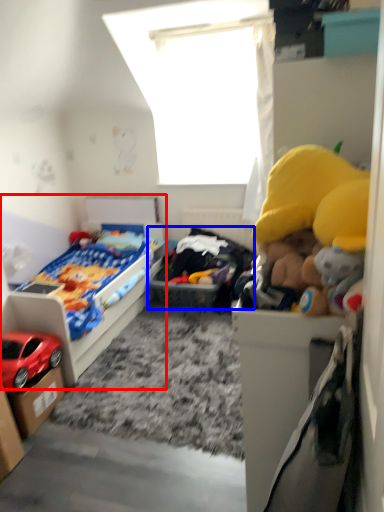
Question: Which of the following is the farthest to the observer, bed (highlighted by a red box) or toy (highlighted by a blue box)?

Choices:
 (A) bed
 (B) toy

Answer: (B)